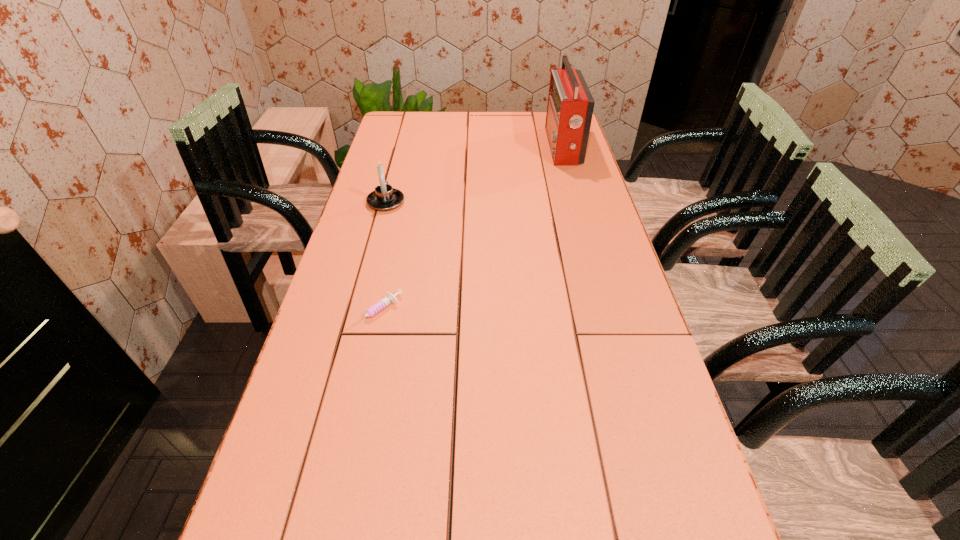
Where is `the tallest object`? This screenshot has height=540, width=960. the tallest object is located at coordinates (570, 106).

Find the location of a particular element. The height and width of the screenshot is (540, 960). the farthest object is located at coordinates (570, 106).

Locate an element on the screen. The height and width of the screenshot is (540, 960). the second farthest object is located at coordinates (384, 198).

Where is `the second tallest object`? the second tallest object is located at coordinates (384, 198).

You are a GUI agent. You are given a task and a screenshot of the screen. Output one action in this format:
    pyautogui.click(x=<x>, y=<y>)
    Task: Click on the nearest object
    The width and height of the screenshot is (960, 540).
    Given the screenshot: What is the action you would take?
    pyautogui.click(x=389, y=299)

Where is `the shortest object`? This screenshot has height=540, width=960. the shortest object is located at coordinates click(389, 299).

The width and height of the screenshot is (960, 540). Find the location of `vacant position located on the front-facing side of the tallest object`. vacant position located on the front-facing side of the tallest object is located at coordinates (448, 147).

Find the location of a particular element. Image resolution: width=960 pixels, height=540 pixels. vacant space located on the front-facing side of the tallest object is located at coordinates (485, 147).

Find the location of `vacant space located 0.100m on the front-facing side of the tallest object`. vacant space located 0.100m on the front-facing side of the tallest object is located at coordinates (521, 147).

Identify the location of free space located with a handle on the side of the candle holder. This screenshot has height=540, width=960. (395, 168).